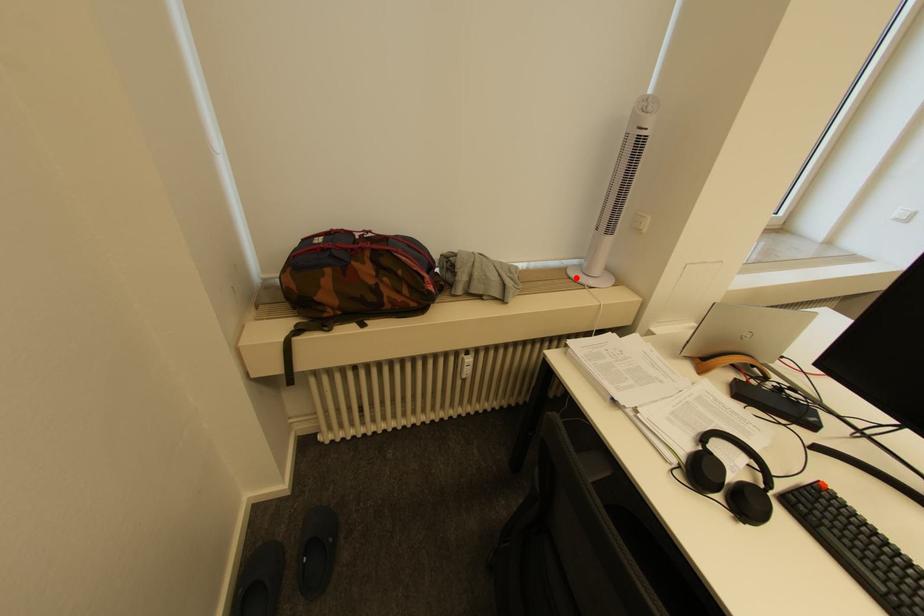
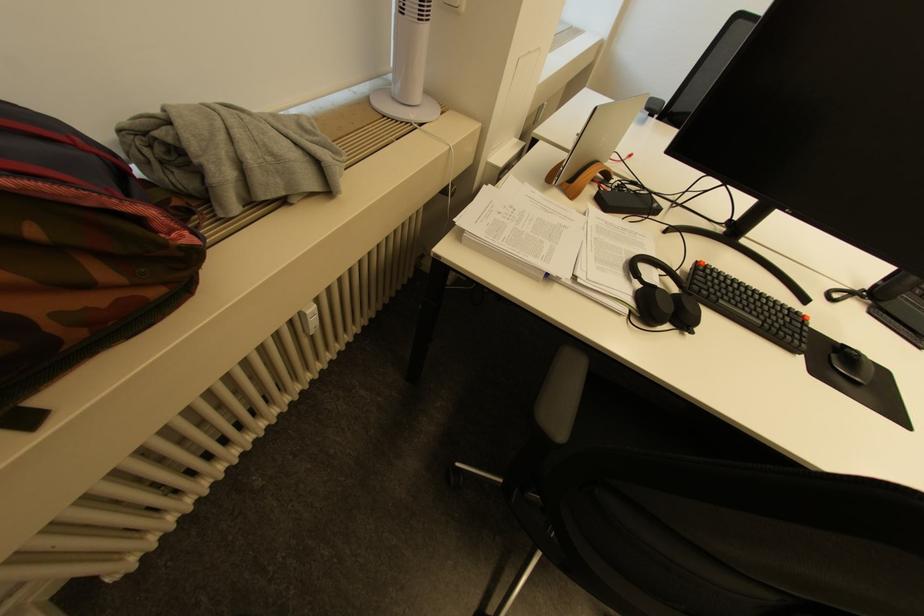
Where in the second image is the point corresponding to the highlighted location from the first image?

(391, 116)